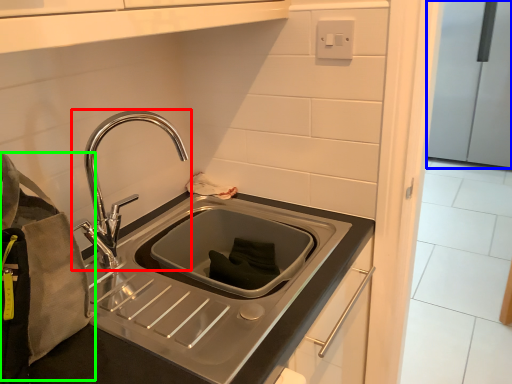
Question: Considering the real-world distances, which object is closest to tap (highlighted by a red box)? appliance (highlighted by a blue box) or pouch (highlighted by a green box).

Choices:
 (A) appliance
 (B) pouch

Answer: (B)